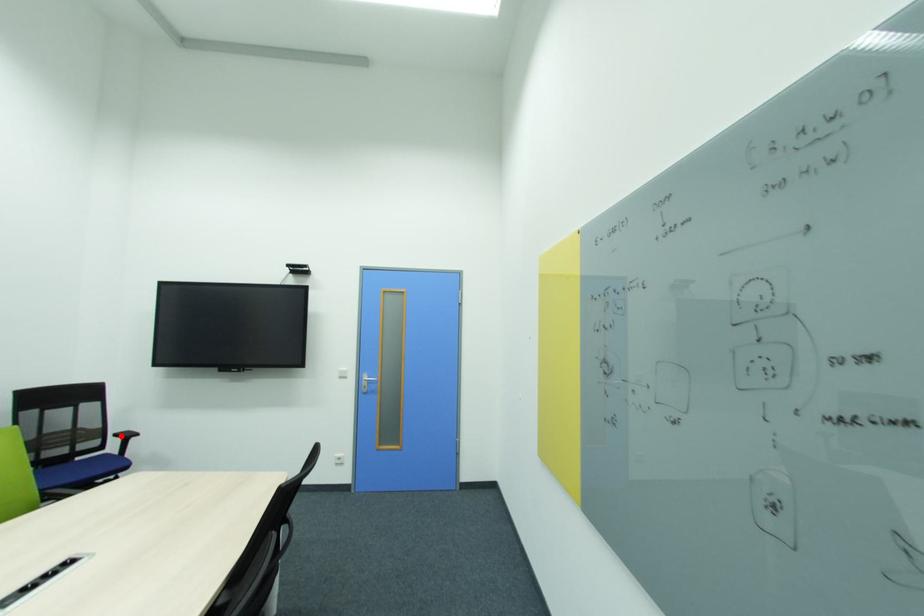
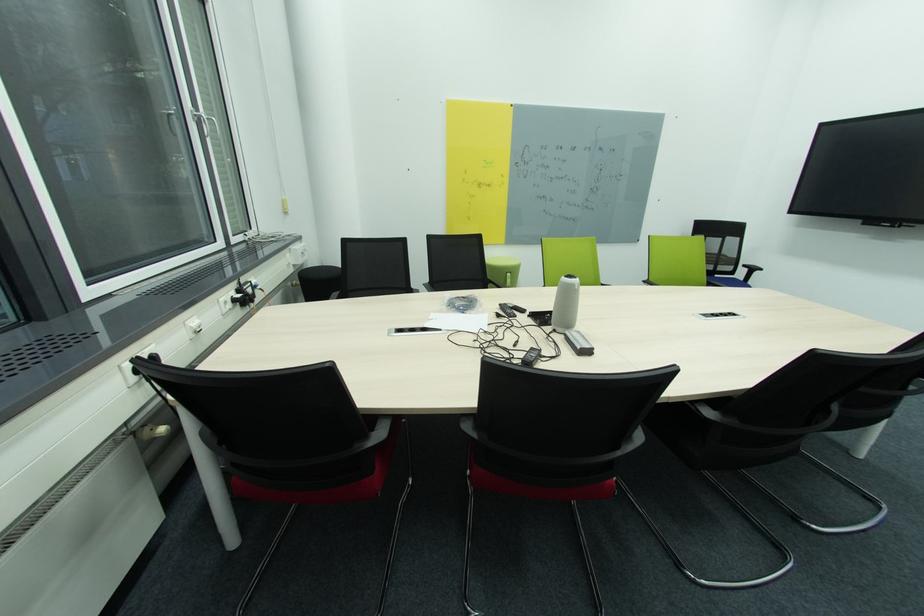
Question: I am providing you with two images of the same scene from different viewpoints. A red point is marked on the first image. Is the red point's position out of view in image 2?

Choices:
 (A) Yes
 (B) No

Answer: (B)